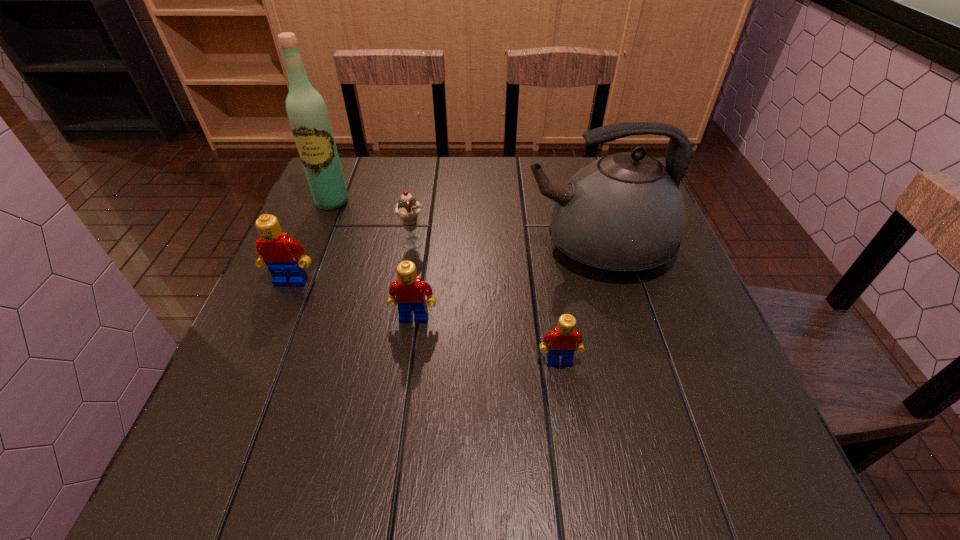
This screenshot has height=540, width=960. Find the location of `free space that satisfies the following two spatial constraints: 1. at the spout of the kettle; 2. on the front-facing side of the rightmost Lego`. free space that satisfies the following two spatial constraints: 1. at the spout of the kettle; 2. on the front-facing side of the rightmost Lego is located at coordinates 631,361.